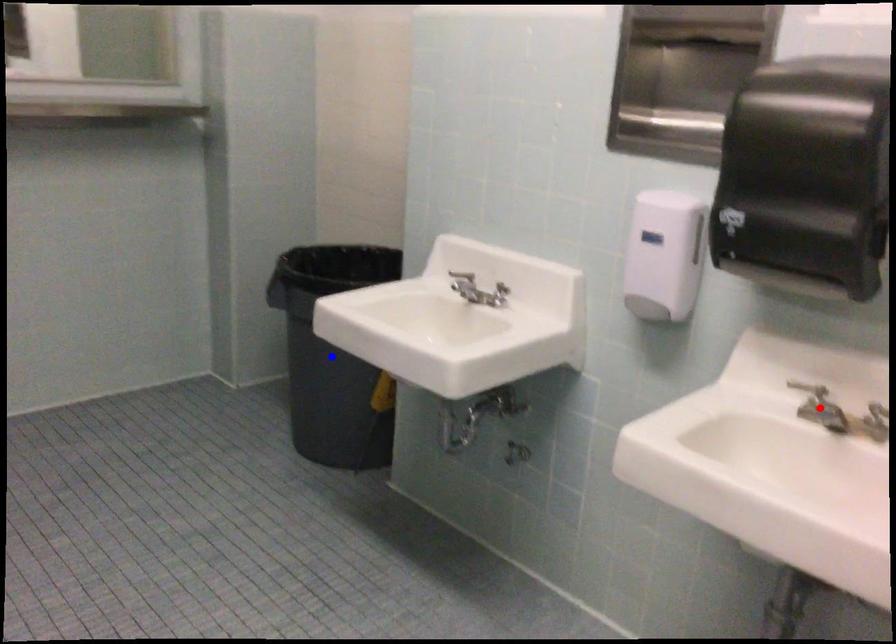
Question: Two points are marked on the image. Which point is closer to the camera?

Choices:
 (A) Blue point is closer.
 (B) Red point is closer.

Answer: (B)